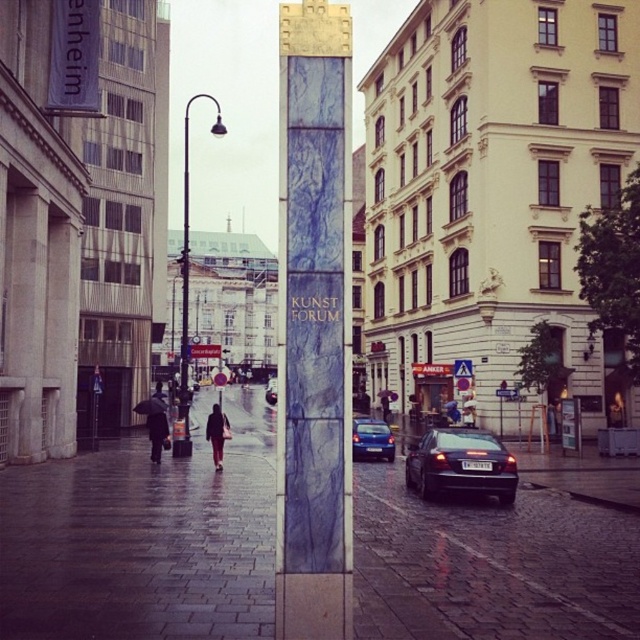
Question: Is blue marble pillar at center thinner than shiny black sedan at lower right?

Choices:
 (A) no
 (B) yes

Answer: (B)

Question: Does black metal pole at left have a greater width compared to metallic blue sedan at center?

Choices:
 (A) no
 (B) yes

Answer: (B)

Question: Among these points, which one is nearest to the camera?

Choices:
 (A) (152, 410)
 (B) (182, 330)
 (C) (420, 444)

Answer: (C)

Question: Among these points, which one is farthest from the camera?

Choices:
 (A) (150, 417)
 (B) (179, 413)
 (C) (216, 470)

Answer: (B)

Question: Which point appears closest to the camera in this image?

Choices:
 (A) (211, 417)
 (B) (380, 390)
 (C) (220, 118)

Answer: (A)

Question: Is blue marble pillar at center smaller than dark brown leather coat at lower center?

Choices:
 (A) no
 (B) yes

Answer: (B)